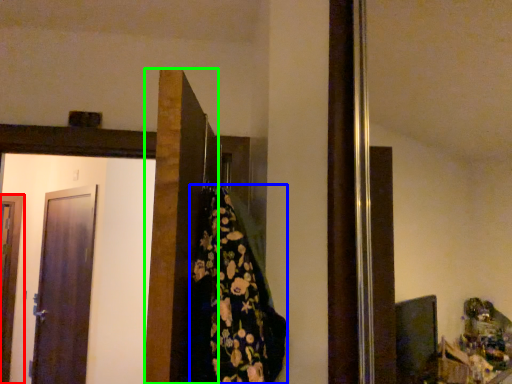
Question: Considering the real-world distances, which object is closest to door (highlighted by a red box)? blanket (highlighted by a blue box) or door (highlighted by a green box).

Choices:
 (A) blanket
 (B) door

Answer: (B)